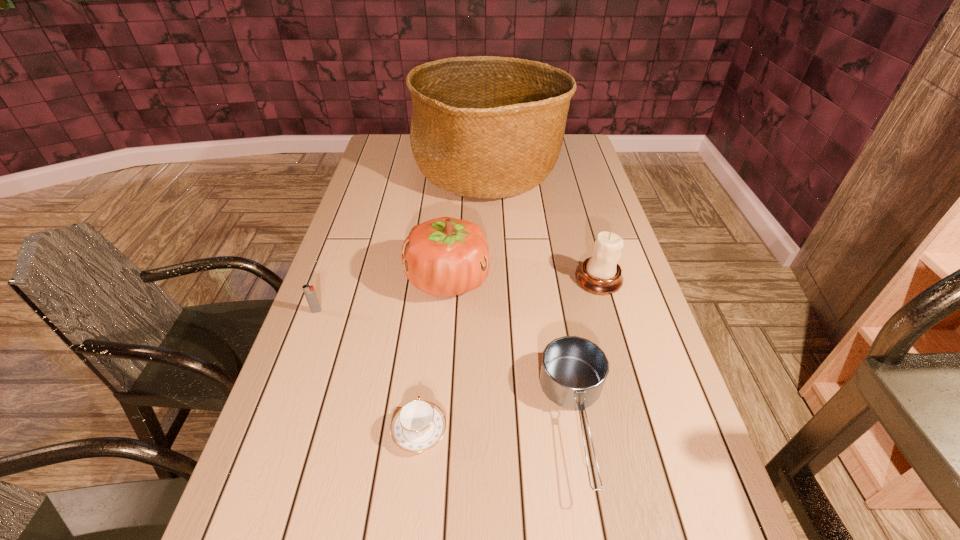
This screenshot has height=540, width=960. What are the coordinates of `vacant area that lies between the teacup and the saucepan` in the screenshot? It's located at (498, 426).

The width and height of the screenshot is (960, 540). Identify the location of free spot between the igniter and the farthest object. (402, 242).

Where is `vacant region between the shortest object and the saucepan`? vacant region between the shortest object and the saucepan is located at coordinates (498, 426).

Select which object is the fifth closest to the third tallest object. Please provide its 2D coordinates. Your answer should be formatted as a tuple, i.e. [(x, y)], where the tuple contains the x and y coordinates of a point satisfying the conditions above.

[(310, 294)]

Locate which object ranks in proximity to the candle holder. Please provide its 2D coordinates. Your answer should be formatted as a tuple, i.e. [(x, y)], where the tuple contains the x and y coordinates of a point satisfying the conditions above.

[(573, 371)]

The height and width of the screenshot is (540, 960). I want to click on vacant space that satisfies the following two spatial constraints: 1. on the front side of the candle holder; 2. on the side of the second tallest object with the cute face, so click(x=599, y=280).